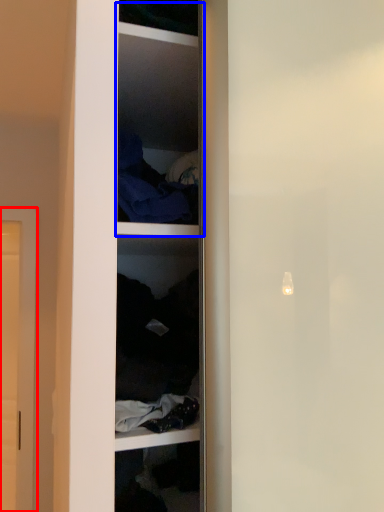
Question: Which object is further to the camera taking this photo, door (highlighted by a red box) or cabinet (highlighted by a blue box)?

Choices:
 (A) door
 (B) cabinet

Answer: (A)